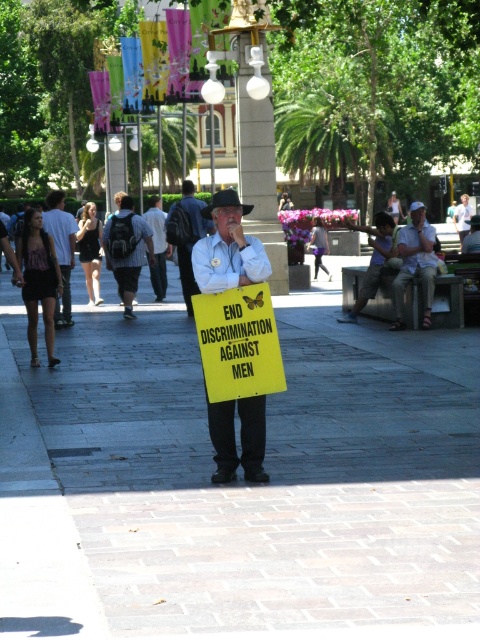
Who is positioned more to the right, yellow paper sign at center or dark gray backpack at left?

yellow paper sign at center is more to the right.

Between point (282, 380) and point (145, 237), which one is positioned behind?

Positioned behind is point (145, 237).

This screenshot has height=640, width=480. What do you see at coordinates (239, 342) in the screenshot?
I see `yellow paper sign at center` at bounding box center [239, 342].

Find the location of a particular element. This screenshot has height=640, width=480. yellow paper sign at center is located at coordinates (239, 342).

How much distance is there between white paper sign at center and dark blue jeans at center?

They are 22.89 meters apart.

Is white paper sign at center wider than dark blue jeans at center?

Yes.

Where is `white paper sign at center`? The height and width of the screenshot is (640, 480). white paper sign at center is located at coordinates (228, 248).

Find the location of a particular element. This screenshot has width=480, height=640. white paper sign at center is located at coordinates (228, 248).

Is light brown leather jacket at left bigger than striped shirt at center?

Yes, light brown leather jacket at left is bigger than striped shirt at center.

Does light brown leather jacket at left appear on the right side of striped shirt at center?

In fact, light brown leather jacket at left is to the left of striped shirt at center.

Describe the element at coordinates (61, 250) in the screenshot. The image size is (480, 640). I see `light brown leather jacket at left` at that location.

Image resolution: width=480 pixels, height=640 pixels. In order to click on light brown leather jacket at left in this screenshot , I will do `click(61, 250)`.